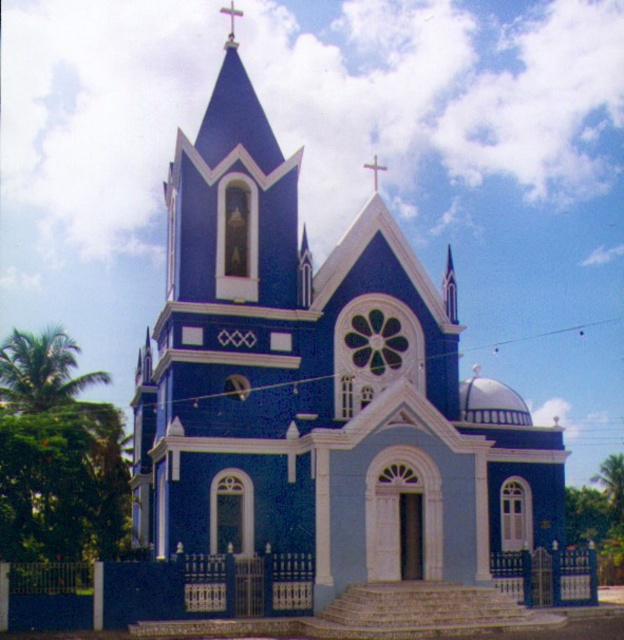
You are standing at the base of the church and notice two crosses at the upper center of the structure. Which cross is closer to you, the metallic cross at upper center or the metallic gold cross at upper center?

Both the metallic cross at upper center and the metallic gold cross at upper center are located at the upper center of the church, so they are at the same distance from you.

You are standing in front of the church and want to place a new decorative flag between the blue painted stone church at center and the metallic gold cross at upper center. Which object should the flag be closer to?

The flag should be placed closer to the blue painted stone church at center since it is positioned under the metallic gold cross at upper center, meaning the cross is above the church.